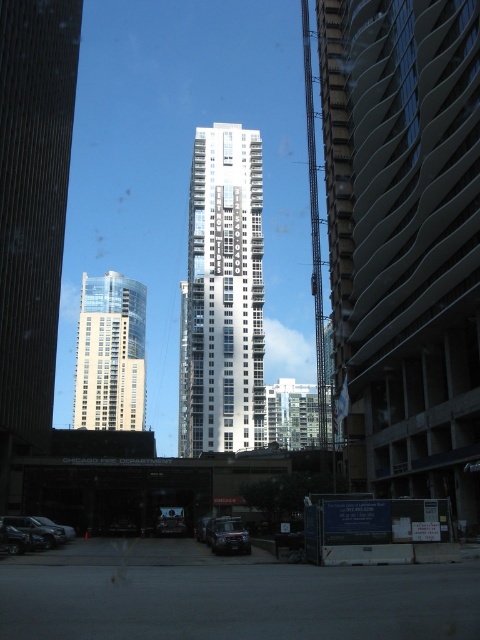
Question: Which object is farther from the camera taking this photo?

Choices:
 (A) silver metallic building at center
 (B) metallic silver crane at center-right
 (C) clear glass tower at center
 (D) smooth concrete building at center

Answer: (C)

Question: Is silver metallic building at center positioned before metallic silver car at center?

Choices:
 (A) no
 (B) yes

Answer: (A)

Question: Does silver metallic building at center appear under shiny black car at center?

Choices:
 (A) no
 (B) yes

Answer: (A)

Question: Which of the following is the closest to the observer?

Choices:
 (A) shiny black car at center
 (B) metallic silver crane at center-right
 (C) smooth concrete building at center

Answer: (A)

Question: Does clear glass tower at center have a smaller size compared to shiny black car at lower left?

Choices:
 (A) yes
 (B) no

Answer: (B)

Question: Which point is closer to the camera?

Choices:
 (A) metallic silver crane at center-right
 (B) clear glass tower at center

Answer: (A)